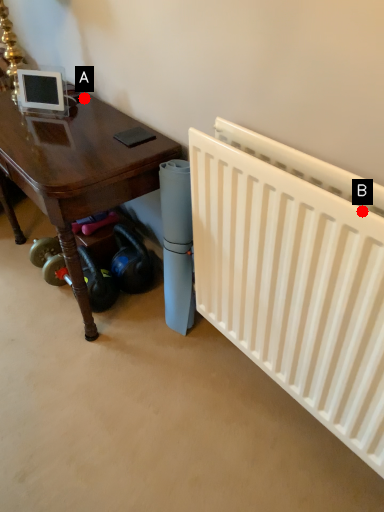
Question: Two points are circled on the image, labeled by A and B beside each circle. Which point is closer to the camera?

Choices:
 (A) A is closer
 (B) B is closer

Answer: (B)